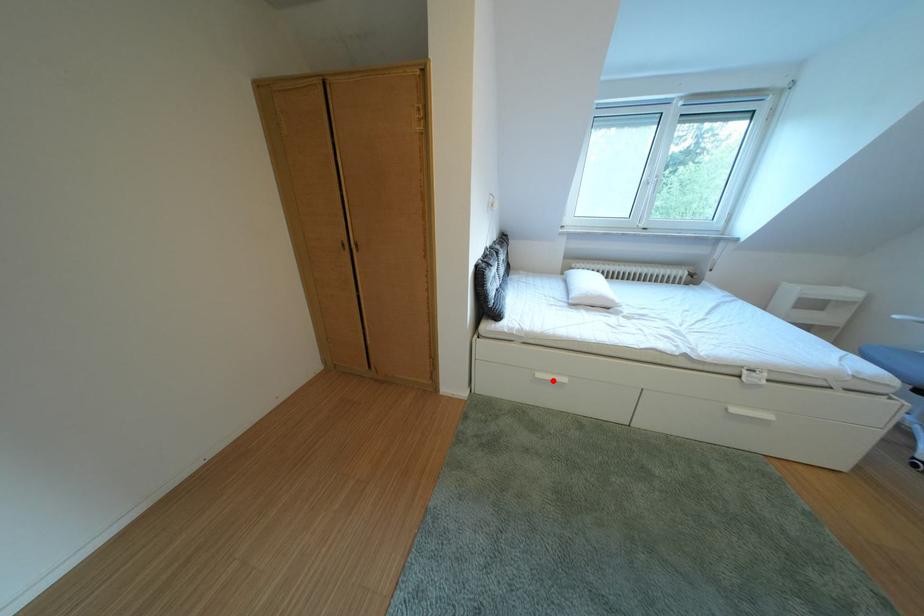
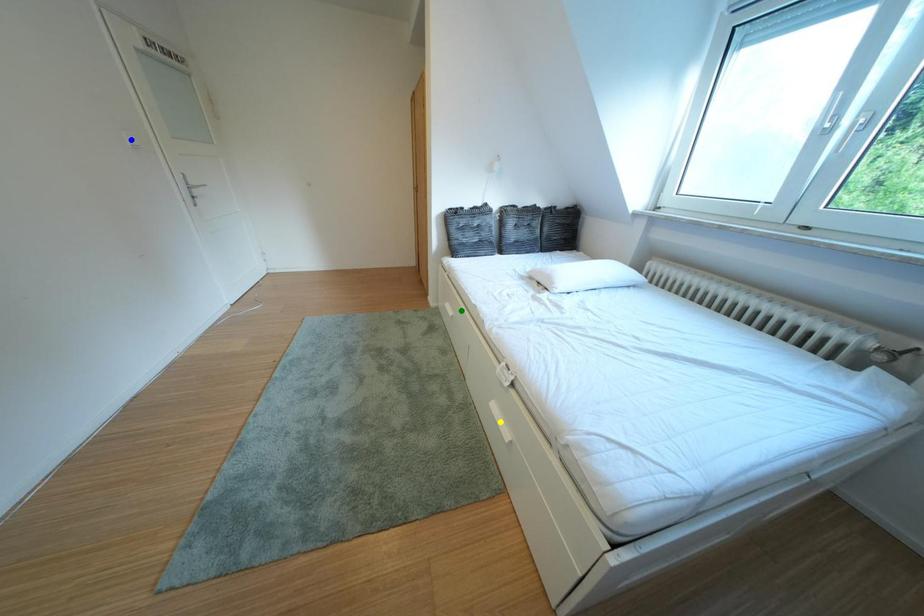
Question: I am providing you with two images of the same scene from different viewpoints. A red point is marked on the first image. You are given multiple points on the second image. Can you choose the point in image 2 that corresponds to the point in image 1?

Choices:
 (A) yellow point
 (B) blue point
 (C) green point

Answer: (C)